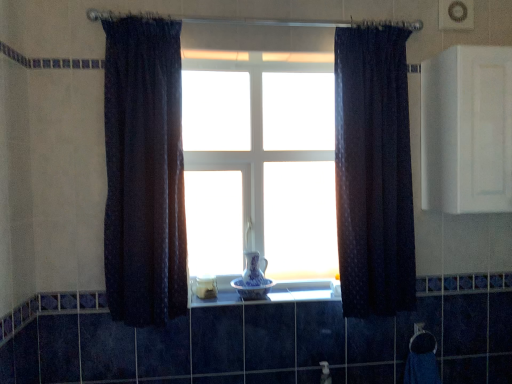
Find the location of a particular element. This screenshot has width=512, height=384. vacant area on top of white glass vase at center (from a real-world perspective) is located at coordinates (245, 62).